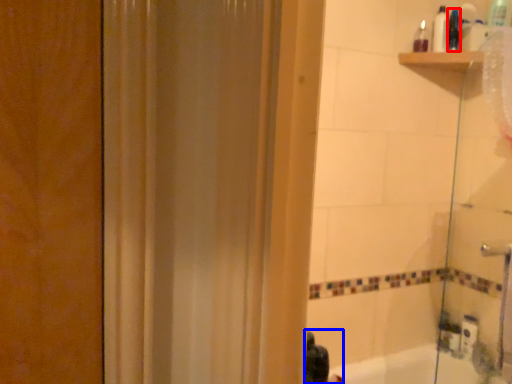
Question: Which object appears farthest to the camera in this image, toiletry (highlighted by a red box) or person (highlighted by a blue box)?

Choices:
 (A) toiletry
 (B) person

Answer: (A)